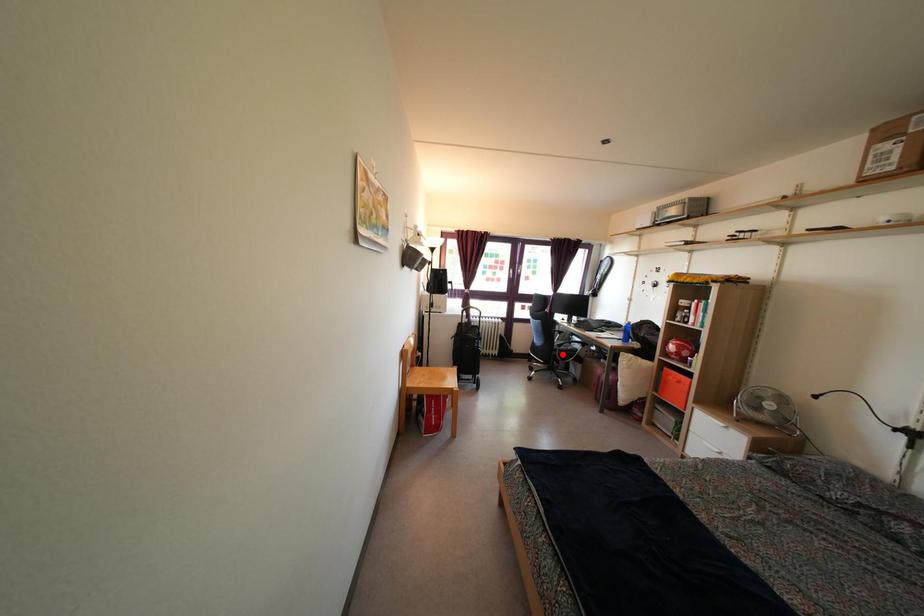
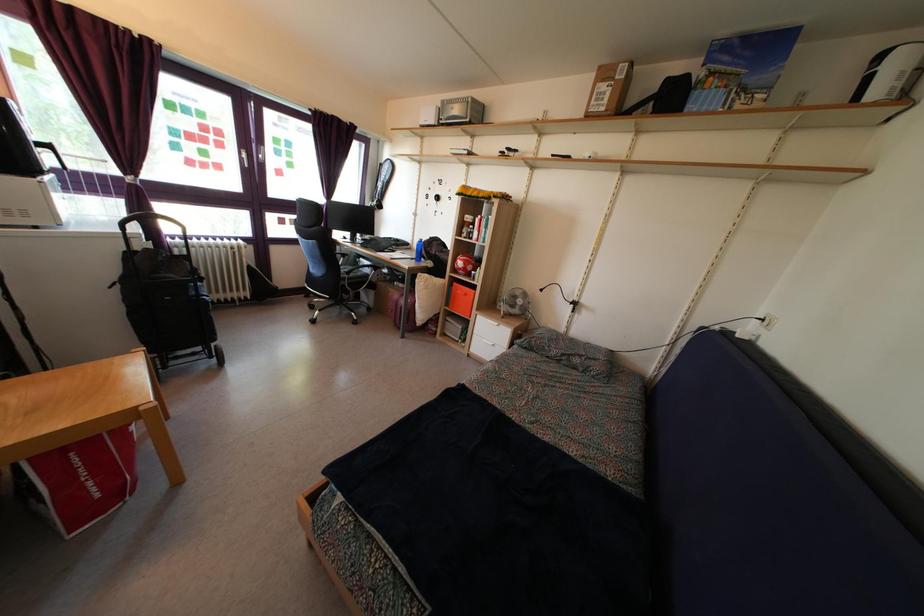
Question: I am providing you with two images of the same scene from different viewpoints. In image1, a red point is highlighted. Considering the same 3D point in image2, which of the following is correct?

Choices:
 (A) It is closer
 (B) It is farther

Answer: (A)